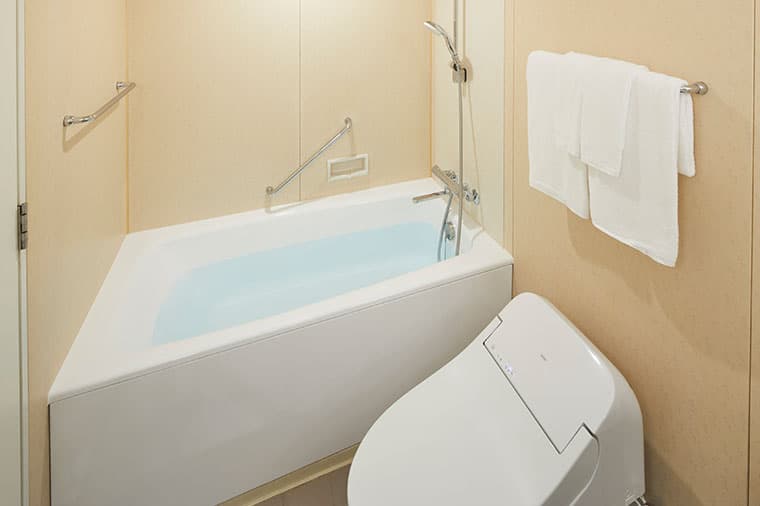
You are a GUI agent. You are given a task and a screenshot of the screen. Output one action in this format:
    pyautogui.click(x=<x>, y=<y>)
    Task: Click on the hinge
    The height and width of the screenshot is (506, 760).
    Given the screenshot: What is the action you would take?
    pyautogui.click(x=23, y=223)